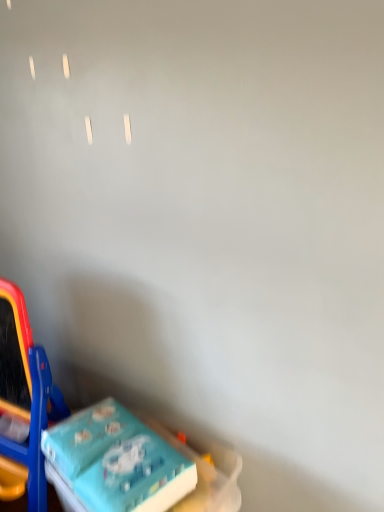
Where is `free location above blue cardboard box at lower left, the 1th toy viewed from the right (from a real-world perspective)`? free location above blue cardboard box at lower left, the 1th toy viewed from the right (from a real-world perspective) is located at coordinates (x=109, y=444).